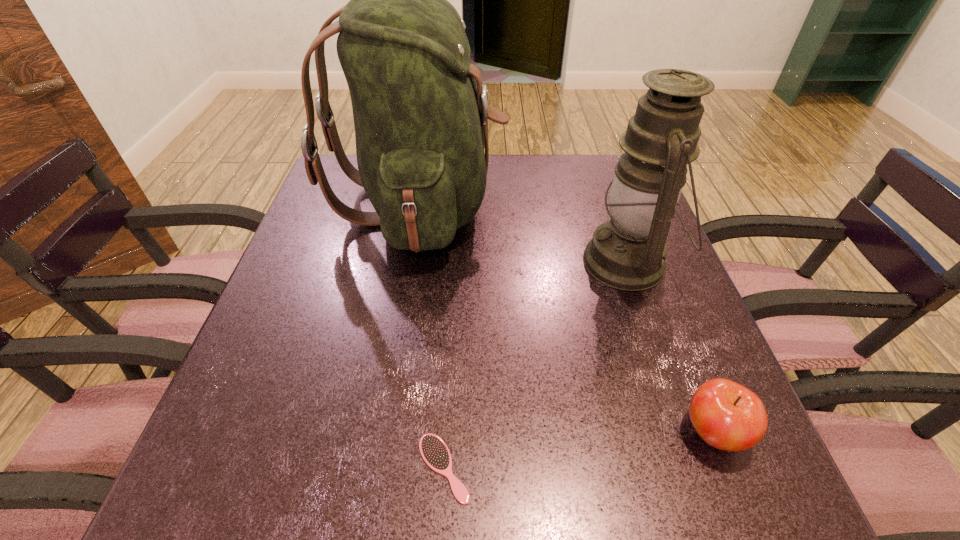
Find the location of a particular element. free space that satisfies the following two spatial constraints: 1. on the open flap of the backpack; 2. on the left side of the apple is located at coordinates (381, 431).

Image resolution: width=960 pixels, height=540 pixels. I want to click on vacant point that satisfies the following two spatial constraints: 1. on the open flap of the backpack; 2. on the right side of the shortest object, so click(x=375, y=468).